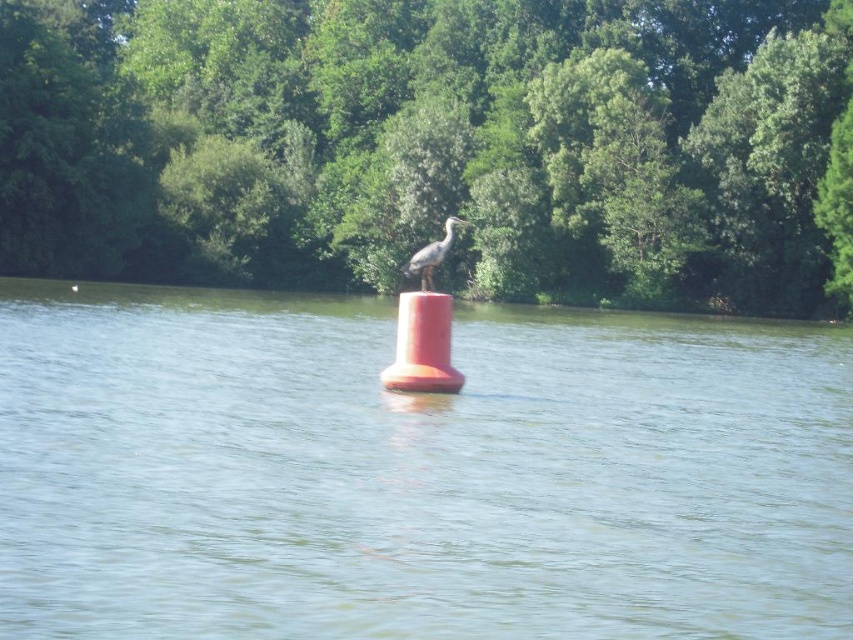
Which of these two, green leafy trees at center or gray feathered bird at center, stands shorter?

gray feathered bird at center

Is point (299, 260) positioned before point (444, 232)?

No, (299, 260) is behind (444, 232).

This screenshot has height=640, width=853. Identify the location of green leafy trees at center. (436, 145).

Consider the image. Who is shorter, orange buoy at center or gray feathered bird at center?

gray feathered bird at center is shorter.

Does point (492, 582) come in front of point (416, 264)?

Yes.

Where is `orange buoy at center`? Image resolution: width=853 pixels, height=640 pixels. orange buoy at center is located at coordinates (415, 472).

Is orange matte buoy at center bigger than gray feathered bird at center?

No.

Find the location of `orange matte buoy at center`. orange matte buoy at center is located at coordinates [x=422, y=346].

The height and width of the screenshot is (640, 853). What do you see at coordinates (422, 346) in the screenshot?
I see `orange matte buoy at center` at bounding box center [422, 346].

Find the location of `orange matte buoy at center`. orange matte buoy at center is located at coordinates click(x=422, y=346).